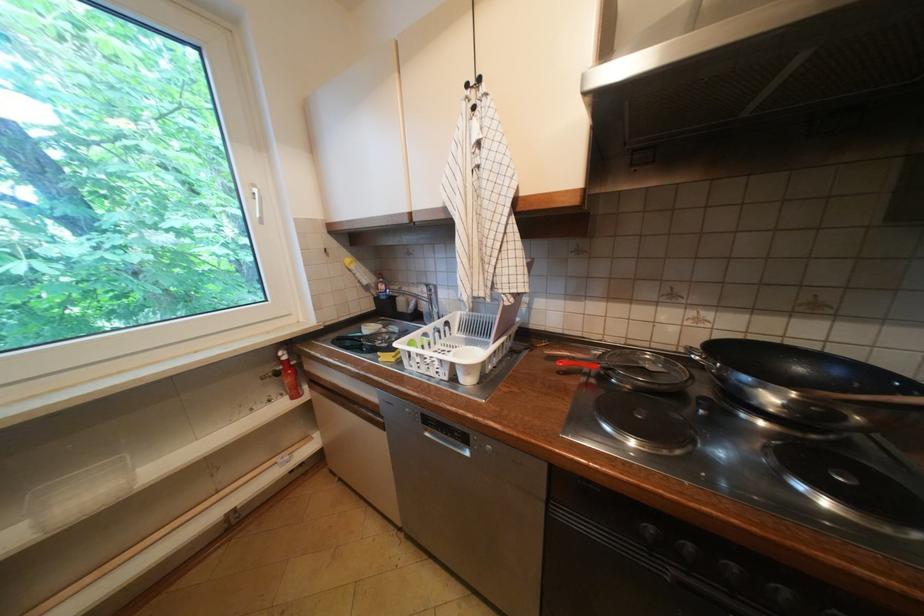
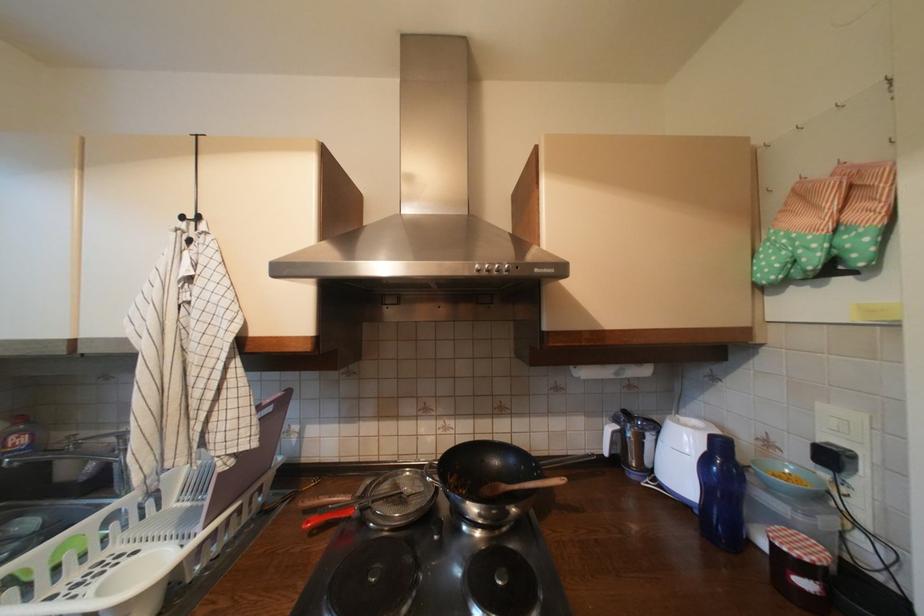
How did the camera likely rotate?

The camera rotated toward right-up.